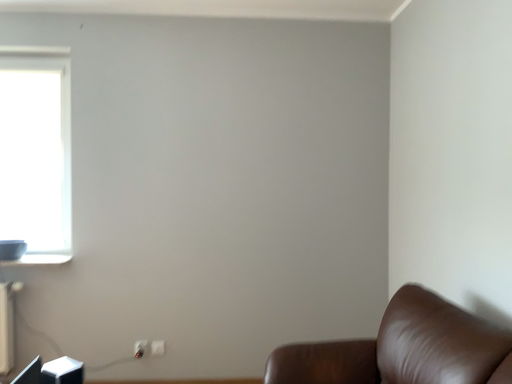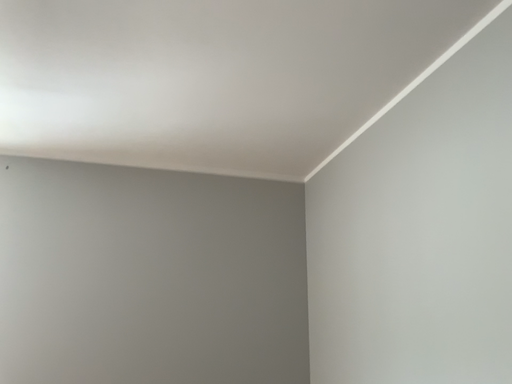
Question: Which way did the camera rotate in the video?

Choices:
 (A) rotated upward
 (B) rotated downward

Answer: (A)